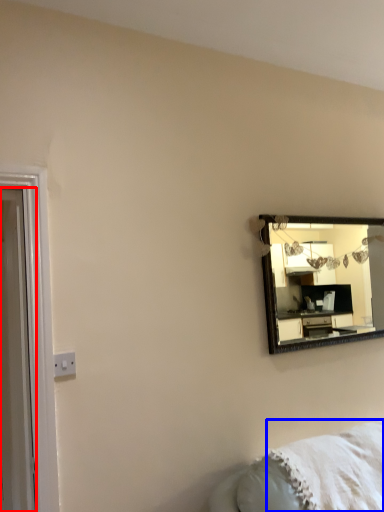
Question: Which object is further to the camera taking this photo, door (highlighted by a red box) or blanket (highlighted by a blue box)?

Choices:
 (A) door
 (B) blanket

Answer: (B)